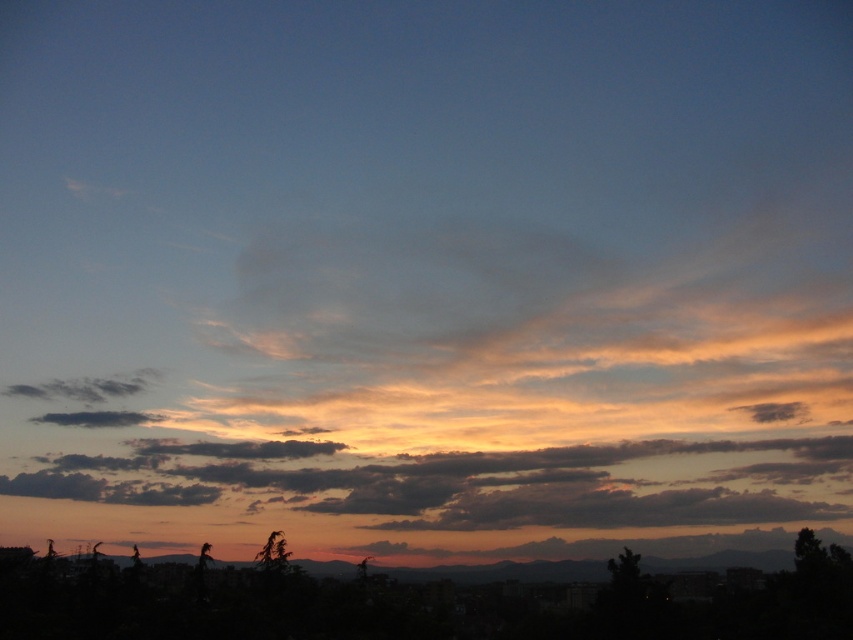
Who is lower down, translucent orange cloud at upper center or cloudy orange sky at center?

Positioned lower is cloudy orange sky at center.

Between point (432, 250) and point (125, 502), which one is positioned behind?

The point (432, 250) is behind.

Does point (666, 528) come farther from viewer compared to point (714, 452)?

No.

What are the coordinates of `translucent orange cloud at upper center` in the screenshot? It's located at (469, 392).